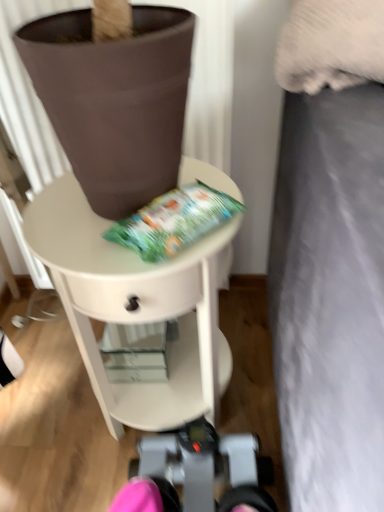
Image resolution: width=384 pixels, height=512 pixels. I want to click on free spot to the left of white glossy table at center, so click(x=46, y=410).